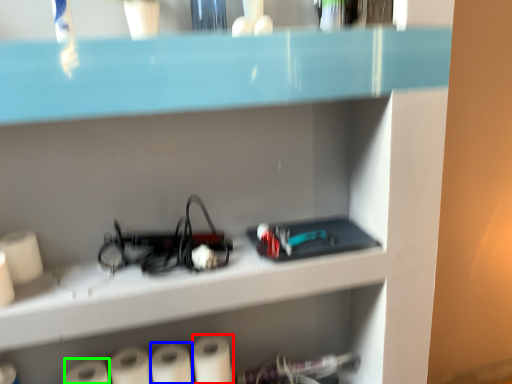
Question: Which is farther away from paper towel (highlighted by a red box)? paper towel (highlighted by a blue box) or paper towel (highlighted by a green box)?

Choices:
 (A) paper towel
 (B) paper towel

Answer: (B)